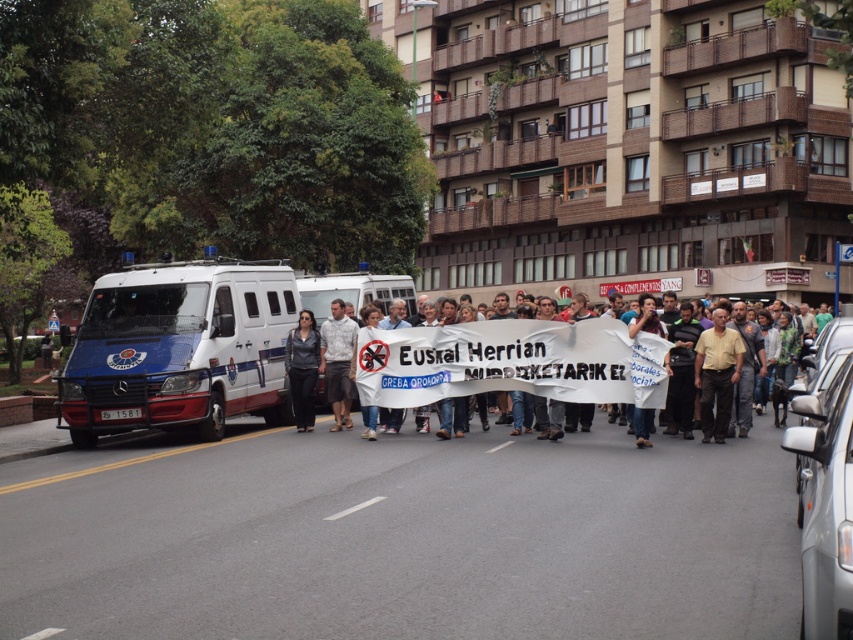
You are a photographer trying to capture a clear shot of both the white printed shirt at center and the dark gray fabric shirt at center in the protest march. Since you want to ensure both are visible in the frame, which shirt should you focus on first to account for their sizes?

The white printed shirt at center is much taller than the dark gray fabric shirt at center, so you should focus on the white printed shirt at center first to ensure it fits within the frame, then adjust to include the smaller dark gray fabric shirt at center.